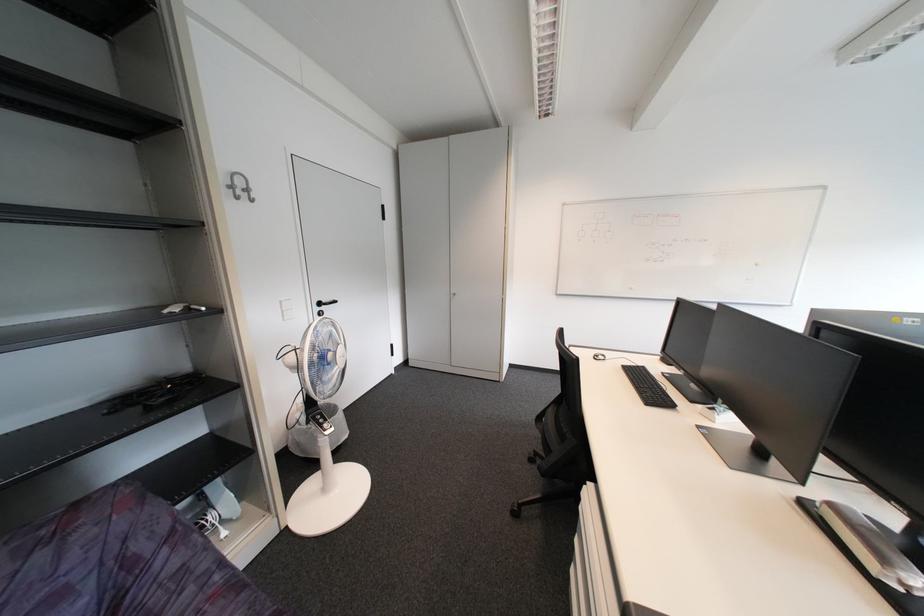
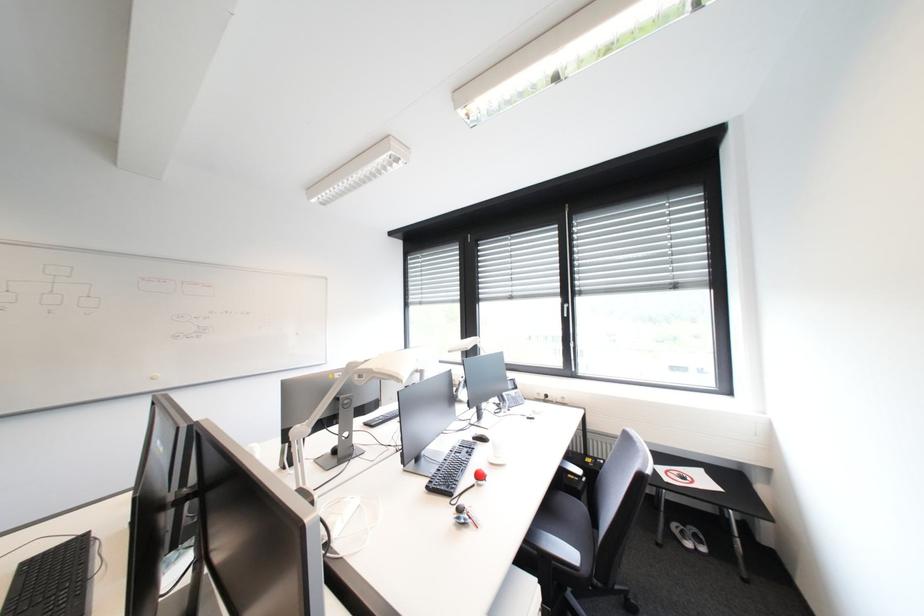
Question: How did the camera likely rotate?

Choices:
 (A) Left
 (B) Right
 (C) Up
 (D) Down

Answer: (B)